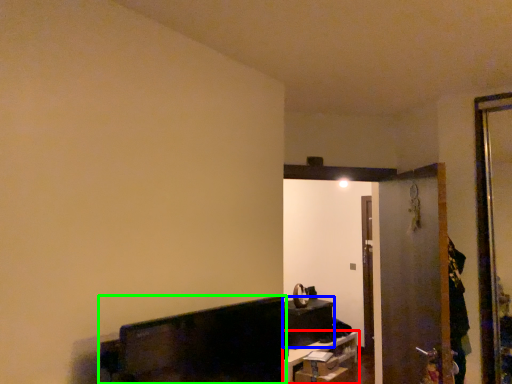
Question: Which object is the closest to the furniture (highlighted by a red box)? Choose among these: furniture (highlighted by a blue box) or furniture (highlighted by a green box).

Choices:
 (A) furniture
 (B) furniture

Answer: (A)